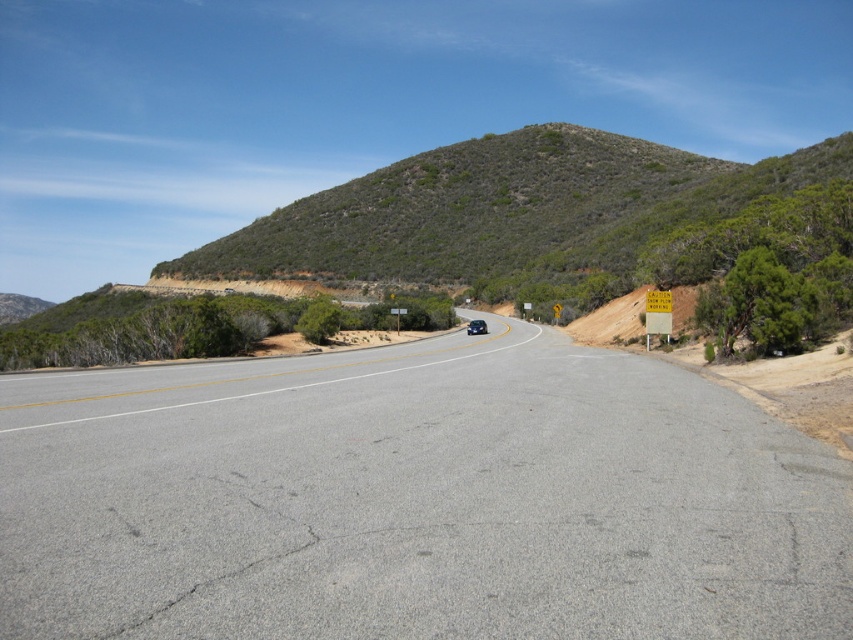
Question: Among these objects, which one is farthest from the camera?

Choices:
 (A) yellow paper street sign at right
 (B) satin blue sedan at center
 (C) gray asphalt road at center

Answer: (B)

Question: Can you confirm if yellow paper street sign at right is positioned below satin blue sedan at center?

Choices:
 (A) yes
 (B) no

Answer: (B)

Question: Estimate the real-world distances between objects in this image. Which object is farther from the yellow paper street sign at right?

Choices:
 (A) satin blue sedan at center
 (B) gray asphalt road at center

Answer: (A)

Question: Does gray asphalt road at center have a lesser width compared to yellow paper street sign at right?

Choices:
 (A) yes
 (B) no

Answer: (B)

Question: Which point is closer to the camera?

Choices:
 (A) satin blue sedan at center
 (B) gray asphalt road at center
 (C) yellow paper street sign at right

Answer: (B)

Question: Can you confirm if gray asphalt road at center is positioned below satin blue sedan at center?

Choices:
 (A) no
 (B) yes

Answer: (B)